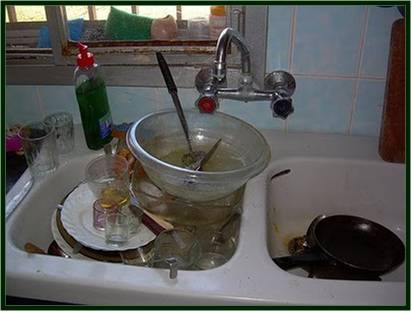
Where is `faucet`? faucet is located at coordinates (243, 58).